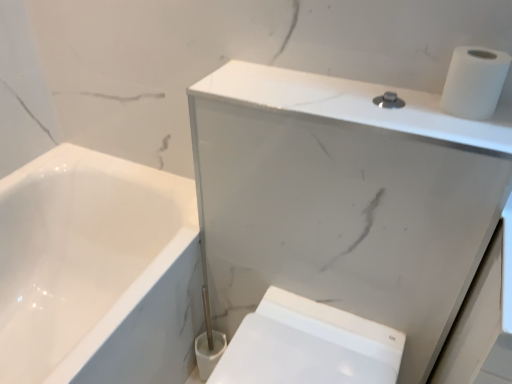
Question: From the image's perspective, is white matte toilet paper at upper right positioned above or below white glossy bidet at lower right?

Choices:
 (A) below
 (B) above

Answer: (B)

Question: Is white matte toilet paper at upper right bigger or smaller than white glossy bidet at lower right?

Choices:
 (A) big
 (B) small

Answer: (B)

Question: Considering the real-world distances, which object is farthest from the white glossy bidet at lower right?

Choices:
 (A) white matte toilet paper at upper right
 (B) white marble cabinet at upper right

Answer: (A)

Question: Estimate the real-world distances between objects in this image. Which object is closer to the white glossy bidet at lower right?

Choices:
 (A) white matte toilet paper at upper right
 (B) white marble cabinet at upper right

Answer: (B)